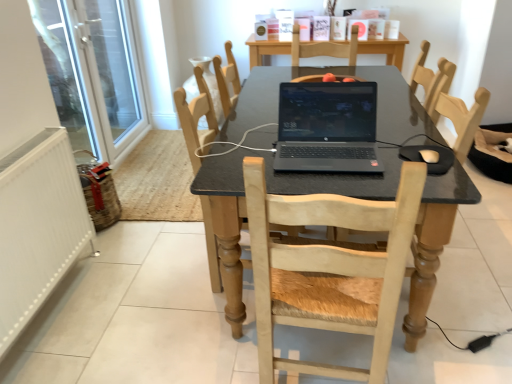
Find the location of a particular element. free space in front of black matte laptop at center is located at coordinates (342, 183).